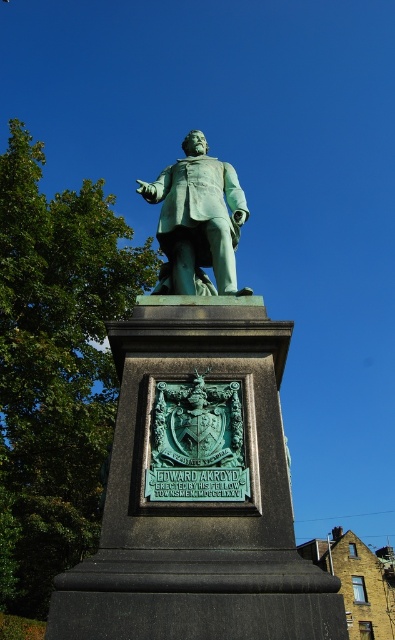
From the picture: Is green patina statue at center below green patinated statue at center?

Yes.

Is point (323, 593) more distant than point (220, 225)?

No, (323, 593) is closer to viewer.

At what (x,y) coordinates should I click in order to perform the action: click on green patina statue at center. Please return your answer as a coordinate pair (x, y). Looking at the image, I should click on (197, 454).